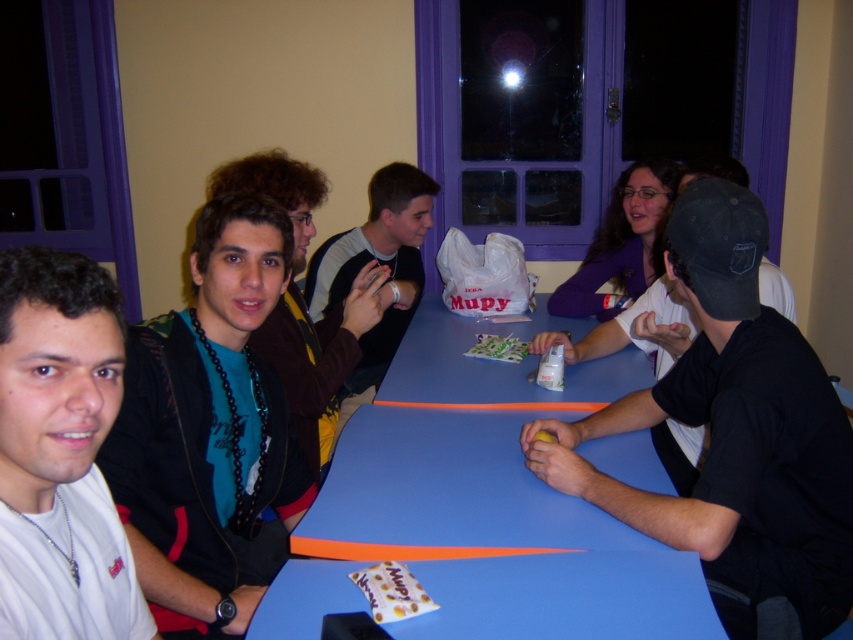
Question: Does black matte cap at right have a lesser width compared to teal matte shirt at center?

Choices:
 (A) no
 (B) yes

Answer: (A)

Question: Which point is closer to the camera taking this photo?

Choices:
 (A) click(316, 168)
 (B) click(115, 300)
 (C) click(347, 284)

Answer: (B)

Question: Which point appears closest to the camera in this image?

Choices:
 (A) (109, 285)
 (B) (193, 269)
 (C) (761, 538)

Answer: (A)

Question: Where is teal fabric shirt at center located in relation to matte black shirt at center in the image?

Choices:
 (A) below
 (B) above

Answer: (A)

Question: Which object is positioned closest to the teal fabric shirt at center?

Choices:
 (A) blue plastic table at center
 (B) matte black shirt at center
 (C) black matte cap at right
 (D) white matte shirt at left

Answer: (A)

Question: Where is white matte shirt at left located in relation to teal matte shirt at center in the image?

Choices:
 (A) left
 (B) right

Answer: (A)